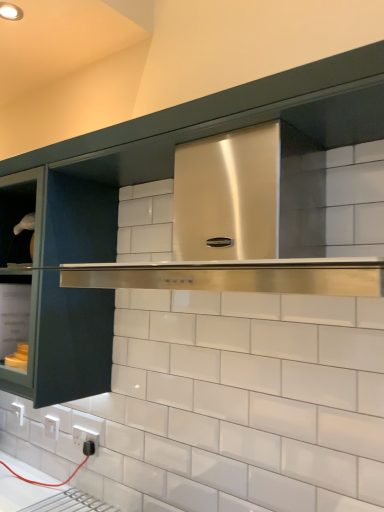
Question: Would you say black plastic electric outlet at lower left, which appears as the 2th electric outlet when viewed from the left, is part of white plastic electric outlet at lower left, marked as the 2th electric outlet in a right-to-left arrangement,'s contents?

Choices:
 (A) no
 (B) yes

Answer: (A)

Question: Considering the relative sizes of white plastic electric outlet at lower left, marked as the 2th electric outlet in a right-to-left arrangement, and black plastic electric outlet at lower left, which appears as the 2th electric outlet when viewed from the left, in the image provided, is white plastic electric outlet at lower left, marked as the 2th electric outlet in a right-to-left arrangement, smaller than black plastic electric outlet at lower left, which appears as the 2th electric outlet when viewed from the left,?

Choices:
 (A) yes
 (B) no

Answer: (A)

Question: Considering the relative positions of white plastic electric outlet at lower left, placed as the 1th electric outlet when sorted from back to front, and black plastic electric outlet at lower left, which appears as the 2th electric outlet when viewed from the left, in the image provided, is white plastic electric outlet at lower left, placed as the 1th electric outlet when sorted from back to front, in front of black plastic electric outlet at lower left, which appears as the 2th electric outlet when viewed from the left,?

Choices:
 (A) yes
 (B) no

Answer: (B)

Question: Can you confirm if white plastic electric outlet at lower left, placed as the 1th electric outlet when sorted from back to front, is thinner than black plastic electric outlet at lower left, placed as the first electric outlet when sorted from front to back?

Choices:
 (A) yes
 (B) no

Answer: (A)

Question: Are white plastic electric outlet at lower left, which is the 2th electric outlet in front-to-back order, and black plastic electric outlet at lower left, which appears as the 2th electric outlet when viewed from the left, far apart?

Choices:
 (A) yes
 (B) no

Answer: (B)

Question: Is black plastic electric outlet at lower left, placed as the first electric outlet when sorted from front to back, taller or shorter than matte black cabinet door at left?

Choices:
 (A) tall
 (B) short

Answer: (B)

Question: From a real-world perspective, is black plastic electric outlet at lower left, which appears as the 2th electric outlet when viewed from the left, above or below matte black cabinet door at left?

Choices:
 (A) below
 (B) above

Answer: (A)

Question: From the image's perspective, is black plastic electric outlet at lower left, placed as the first electric outlet when sorted from front to back, above or below matte black cabinet door at left?

Choices:
 (A) below
 (B) above

Answer: (A)

Question: Considering the positions of black plastic electric outlet at lower left, the second electric outlet viewed from the back, and matte black cabinet door at left in the image, is black plastic electric outlet at lower left, the second electric outlet viewed from the back, wider or thinner than matte black cabinet door at left?

Choices:
 (A) thin
 (B) wide

Answer: (A)

Question: Looking at the image, does stainless steel range hood at center seem bigger or smaller compared to black plastic electric outlet at lower left, the second electric outlet viewed from the back?

Choices:
 (A) small
 (B) big

Answer: (B)

Question: Is stainless steel range hood at center in front of or behind black plastic electric outlet at lower left, placed as the first electric outlet when sorted from front to back, in the image?

Choices:
 (A) front
 (B) behind

Answer: (A)

Question: Is point (359, 139) positioned closer to the camera than point (79, 425)?

Choices:
 (A) farther
 (B) closer

Answer: (B)

Question: Looking at their shapes, would you say stainless steel range hood at center is wider or thinner than black plastic electric outlet at lower left, which appears as the 2th electric outlet when viewed from the left?

Choices:
 (A) wide
 (B) thin

Answer: (A)

Question: Considering the positions of black plastic electric outlet at lower left, which appears as the 2th electric outlet when viewed from the left, and stainless steel range hood at center in the image, is black plastic electric outlet at lower left, which appears as the 2th electric outlet when viewed from the left, wider or thinner than stainless steel range hood at center?

Choices:
 (A) wide
 (B) thin

Answer: (B)

Question: Is point (79, 437) positioned closer to the camera than point (56, 168)?

Choices:
 (A) farther
 (B) closer

Answer: (A)